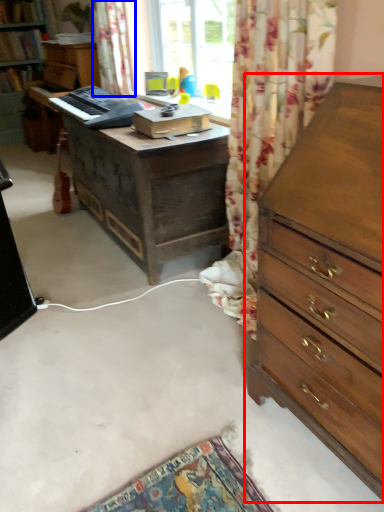
Question: Which of the following is the farthest to the observer, chest of drawers (highlighted by a red box) or curtain (highlighted by a blue box)?

Choices:
 (A) chest of drawers
 (B) curtain

Answer: (B)